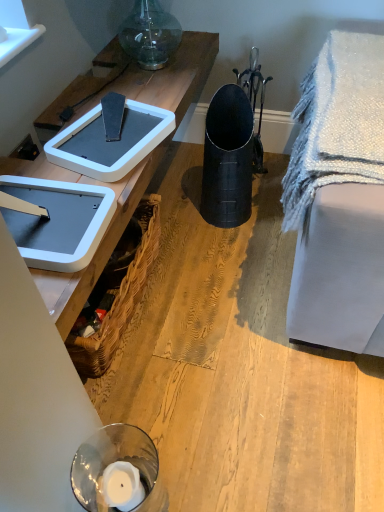
What is the approximate width of white plastic weight scale at upper left, marked as the 1th weight scale in a back-to-front arrangement?

white plastic weight scale at upper left, marked as the 1th weight scale in a back-to-front arrangement, is 14.29 inches in width.

What do you see at coordinates (227, 159) in the screenshot? This screenshot has height=512, width=384. I see `black matte trash bin/can at center` at bounding box center [227, 159].

Identify the location of white textured blanket at right. (337, 124).

Locate an element on the screen. The height and width of the screenshot is (512, 384). white plastic weight scale at upper left, which is counted as the second weight scale, starting from the front is located at coordinates (110, 141).

How distant is matte black trash can at center from woven brown picnic basket at lower left?

matte black trash can at center and woven brown picnic basket at lower left are 13.29 inches apart from each other.

In the scene shown: Considering the relative positions of matte black trash can at center and woven brown picnic basket at lower left in the image provided, is matte black trash can at center to the left of woven brown picnic basket at lower left from the viewer's perspective?

No.

Which of these two, matte black trash can at center or woven brown picnic basket at lower left, is smaller?

Smaller between the two is woven brown picnic basket at lower left.

Does point (195, 376) appear closer or farther from the camera than point (132, 303)?

Point (195, 376) is closer to the camera than point (132, 303).

Does white plastic weight scale at upper left, positioned as the first weight scale in front-to-back order, have a larger size compared to white plastic weight scale at upper left, marked as the 1th weight scale in a back-to-front arrangement?

Correct, white plastic weight scale at upper left, positioned as the first weight scale in front-to-back order, is larger in size than white plastic weight scale at upper left, marked as the 1th weight scale in a back-to-front arrangement.

Does point (45, 234) appear closer or farther from the camera than point (134, 103)?

Point (45, 234) appears to be closer to the viewer than point (134, 103).

Is the surface of white plastic weight scale at upper left, the 2th weight scale viewed from the back, in direct contact with white plastic weight scale at upper left, marked as the 1th weight scale in a back-to-front arrangement?

No.

Considering the sizes of white plastic weight scale at upper left, positioned as the first weight scale in front-to-back order, and white plastic weight scale at upper left, which is counted as the second weight scale, starting from the front, in the image, is white plastic weight scale at upper left, positioned as the first weight scale in front-to-back order, taller or shorter than white plastic weight scale at upper left, which is counted as the second weight scale, starting from the front,?

white plastic weight scale at upper left, positioned as the first weight scale in front-to-back order, is taller than white plastic weight scale at upper left, which is counted as the second weight scale, starting from the front.

Is white plastic weight scale at upper left, positioned as the first weight scale in front-to-back order, smaller than woven brown picnic basket at lower left?

Correct, white plastic weight scale at upper left, positioned as the first weight scale in front-to-back order, occupies less space than woven brown picnic basket at lower left.

From the picture: Is white plastic weight scale at upper left, positioned as the first weight scale in front-to-back order, aimed at woven brown picnic basket at lower left?

No, white plastic weight scale at upper left, positioned as the first weight scale in front-to-back order, is not oriented towards woven brown picnic basket at lower left.

Are white plastic weight scale at upper left, positioned as the first weight scale in front-to-back order, and woven brown picnic basket at lower left beside each other?

No, white plastic weight scale at upper left, positioned as the first weight scale in front-to-back order, is not with woven brown picnic basket at lower left.

Which point is more forward, [74,231] or [133,280]?

The point [74,231] is closer to the camera.

In terms of width, does black matte trash bin/can at center look wider or thinner when compared to white plastic weight scale at upper left, positioned as the first weight scale in front-to-back order?

Clearly, black matte trash bin/can at center has less width compared to white plastic weight scale at upper left, positioned as the first weight scale in front-to-back order.

Between black matte trash bin/can at center and white plastic weight scale at upper left, the 2th weight scale viewed from the back, which one has larger size?

black matte trash bin/can at center is bigger.

Choose the correct answer: Is black matte trash bin/can at center inside white plastic weight scale at upper left, positioned as the first weight scale in front-to-back order, or outside it?

black matte trash bin/can at center is not inside white plastic weight scale at upper left, positioned as the first weight scale in front-to-back order, it's outside.

From the black matte trash bin/can at center, count the 2nd weight scale to the left and point to it. Please provide its 2D coordinates.

[(58, 221)]

Which of these two, white textured blanket at right or matte black trash can at center, is thinner?

white textured blanket at right is thinner.

What are the coordinates of `blanket above the matte black trash can at center (from a real-world perspective)` in the screenshot? It's located at (337, 124).

Who is smaller, white textured blanket at right or matte black trash can at center?

white textured blanket at right.

Is white textured blanket at right at the left side of matte black trash can at center?

No, white textured blanket at right is not to the left of matte black trash can at center.

Is matte black trash can at center wider than black matte trash bin/can at center?

Correct, the width of matte black trash can at center exceeds that of black matte trash bin/can at center.

From a real-world perspective, is matte black trash can at center below black matte trash bin/can at center?

Yes, from a real-world perspective, matte black trash can at center is beneath black matte trash bin/can at center.

Based on the photo, from the image's perspective, is matte black trash can at center on top of black matte trash bin/can at center?

No, from the image's perspective, matte black trash can at center is not above black matte trash bin/can at center.

Can you tell me how much woven brown picnic basket at lower left and matte black trash can at center differ in facing direction?

The facing directions of woven brown picnic basket at lower left and matte black trash can at center are 1.98 degrees apart.

Is woven brown picnic basket at lower left not near matte black trash can at center?

No, woven brown picnic basket at lower left is in close proximity to matte black trash can at center.

Considering the relative sizes of woven brown picnic basket at lower left and matte black trash can at center in the image provided, is woven brown picnic basket at lower left smaller than matte black trash can at center?

Yes.

Locate an element on the screen. The height and width of the screenshot is (512, 384). picnic basket above the matte black trash can at center (from a real-world perspective) is located at coordinates (120, 296).

The width and height of the screenshot is (384, 512). Find the location of `weight scale lying above the white plastic weight scale at upper left, the 2th weight scale viewed from the back (from the image's perspective)`. weight scale lying above the white plastic weight scale at upper left, the 2th weight scale viewed from the back (from the image's perspective) is located at coordinates (110, 141).

From the image, which object appears to be nearer to woven brown picnic basket at lower left, black matte trash bin/can at center or matte black trash can at center?

The object closer to woven brown picnic basket at lower left is matte black trash can at center.

Looking at the image, which one is located closer to white plastic weight scale at upper left, marked as the 1th weight scale in a back-to-front arrangement, black matte trash bin/can at center or matte black trash can at center?

Among the two, black matte trash bin/can at center is located nearer to white plastic weight scale at upper left, marked as the 1th weight scale in a back-to-front arrangement.

Looking at the image, which one is located further to white plastic weight scale at upper left, positioned as the first weight scale in front-to-back order, matte black trash can at center or white textured blanket at right?

matte black trash can at center.

Based on their spatial positions, is matte black trash can at center or black matte trash bin/can at center closer to white plastic weight scale at upper left, which is counted as the second weight scale, starting from the front?

black matte trash bin/can at center.

When comparing their distances from matte black trash can at center, does white plastic weight scale at upper left, the 2th weight scale viewed from the back, or white textured blanket at right seem closer?

white textured blanket at right lies closer to matte black trash can at center than the other object.

From the image, which object appears to be farther from woven brown picnic basket at lower left, matte black trash can at center or white plastic weight scale at upper left, marked as the 1th weight scale in a back-to-front arrangement?

The object further to woven brown picnic basket at lower left is white plastic weight scale at upper left, marked as the 1th weight scale in a back-to-front arrangement.

When comparing their distances from white plastic weight scale at upper left, positioned as the first weight scale in front-to-back order, does white textured blanket at right or woven brown picnic basket at lower left seem further?

The object further to white plastic weight scale at upper left, positioned as the first weight scale in front-to-back order, is white textured blanket at right.

Estimate the real-world distances between objects in this image. Which object is closer to white plastic weight scale at upper left, which is counted as the second weight scale, starting from the front, white textured blanket at right or woven brown picnic basket at lower left?

Among the two, woven brown picnic basket at lower left is located nearer to white plastic weight scale at upper left, which is counted as the second weight scale, starting from the front.

Where is `trash bin/can between white plastic weight scale at upper left, the 2th weight scale viewed from the back, and matte black trash can at center from left to right`? Image resolution: width=384 pixels, height=512 pixels. trash bin/can between white plastic weight scale at upper left, the 2th weight scale viewed from the back, and matte black trash can at center from left to right is located at coordinates (227, 159).

Where is `weight scale between white plastic weight scale at upper left, which is counted as the second weight scale, starting from the front, and woven brown picnic basket at lower left in the up-down direction`? This screenshot has width=384, height=512. weight scale between white plastic weight scale at upper left, which is counted as the second weight scale, starting from the front, and woven brown picnic basket at lower left in the up-down direction is located at coordinates (58, 221).

Where is `trash bin/can located between woven brown picnic basket at lower left and white textured blanket at right in the left-right direction`? trash bin/can located between woven brown picnic basket at lower left and white textured blanket at right in the left-right direction is located at coordinates (227, 159).

Identify the location of weight scale situated between white plastic weight scale at upper left, the 2th weight scale viewed from the back, and white textured blanket at right from left to right. The width and height of the screenshot is (384, 512). (110, 141).